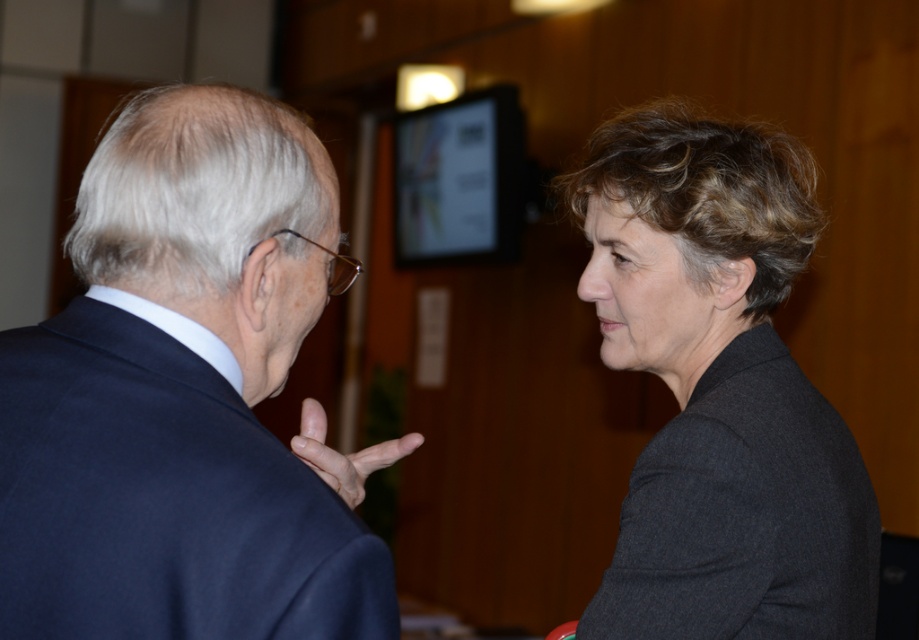
Between dark blue suit at left and matte black hand at center, which one appears on the left side from the viewer's perspective?

Positioned to the left is dark blue suit at left.

Which is below, dark blue suit at left or matte black hand at center?

matte black hand at center is below.

This screenshot has height=640, width=919. What do you see at coordinates (186, 396) in the screenshot?
I see `dark blue suit at left` at bounding box center [186, 396].

Find the location of a particular element. The width and height of the screenshot is (919, 640). dark blue suit at left is located at coordinates (186, 396).

Can you confirm if dark blue suit at left is positioned above dark gray woolen blazer at right?

Actually, dark blue suit at left is below dark gray woolen blazer at right.

The width and height of the screenshot is (919, 640). I want to click on dark blue suit at left, so tap(186, 396).

Is point (146, 232) farther from camera compared to point (645, 560)?

No, (146, 232) is in front of (645, 560).

This screenshot has height=640, width=919. In order to click on dark blue suit at left in this screenshot , I will do `click(186, 396)`.

Describe the element at coordinates (719, 388) in the screenshot. Image resolution: width=919 pixels, height=640 pixels. I see `dark gray woolen blazer at right` at that location.

Between dark gray woolen blazer at right and matte black hand at center, which one appears on the left side from the viewer's perspective?

Positioned to the left is matte black hand at center.

Measure the distance between dark gray woolen blazer at right and camera.

A distance of 3.66 feet exists between dark gray woolen blazer at right and camera.

Locate an element on the screen. This screenshot has height=640, width=919. dark gray woolen blazer at right is located at coordinates (719, 388).